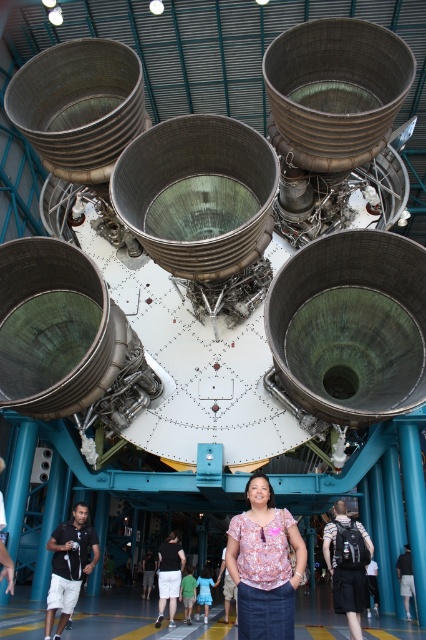
Consider the image. Which is more to the right, pink floral blouse at center or floral blouse at center?

pink floral blouse at center is more to the right.

Who is more distant from viewer, (279, 625) or (169, 572)?

The point (169, 572) is behind.

Between point (267, 634) and point (184, 552), which one is positioned behind?

The point (184, 552) is behind.

Find the location of a particular element. pink floral blouse at center is located at coordinates (264, 564).